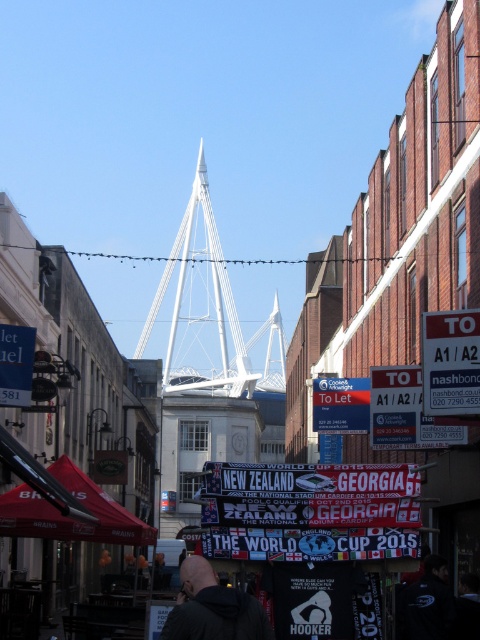
You are a photographer standing on the sidewalk in this urban scene. You want to take a photo of the dark gray jacket at lower center and the black fabric person at lower right. Which object should you focus on first if you want to capture both in the frame without moving the camera?

The dark gray jacket at lower center is positioned on the left side of the black fabric person at lower right, so you should focus on the dark gray jacket at lower center first to ensure both are in the frame.

You are standing on the street in the scene and see both the black fabric jacket at lower right and the black fabric person at lower right. Which one is nearer to you?

The black fabric jacket at lower right is closer to the viewer than the black fabric person at lower right.